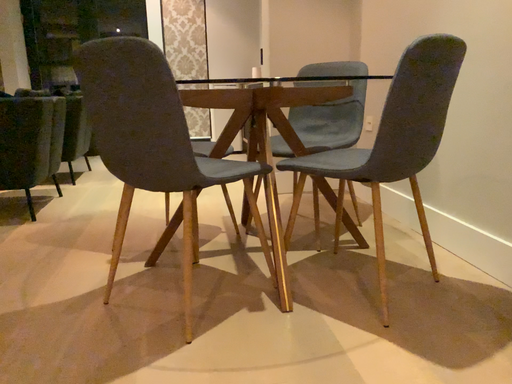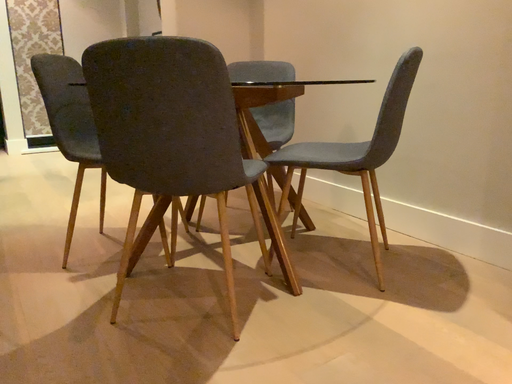
Question: Which way did the camera rotate in the video?

Choices:
 (A) rotated right
 (B) rotated left

Answer: (A)